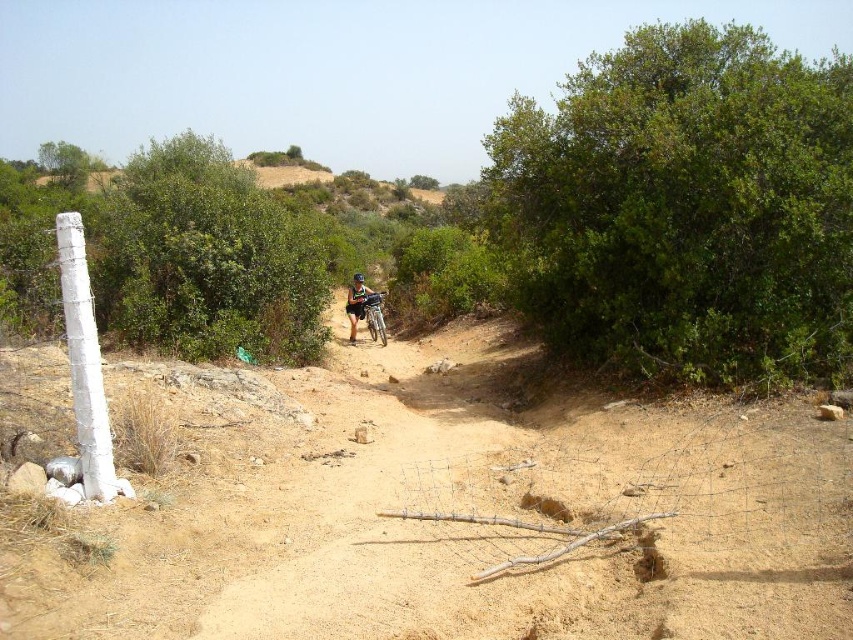
Who is more forward, (367,308) or (347,308)?

Point (367,308)

Does silver metallic mountain bike at center have a greater width compared to green fabric shirt at center?

No, silver metallic mountain bike at center is not wider than green fabric shirt at center.

Locate an element on the screen. Image resolution: width=853 pixels, height=640 pixels. silver metallic mountain bike at center is located at coordinates (372, 314).